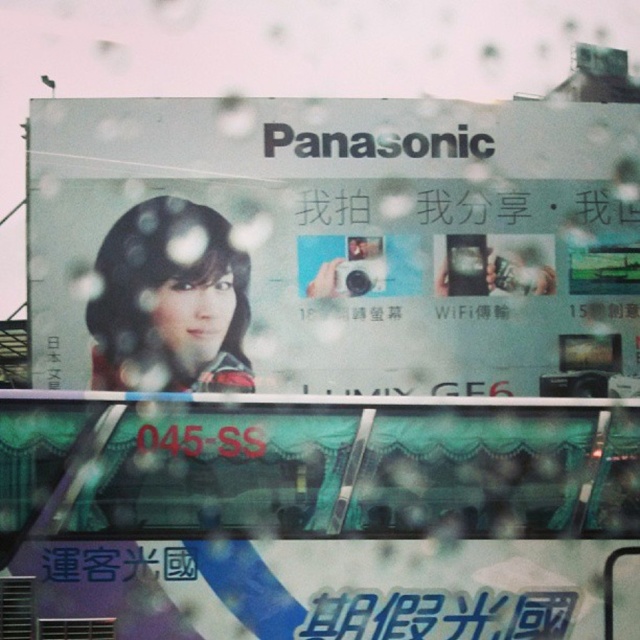
You are a pedestrian looking at the Panasonic billboard. You notice the teal fabric covered bus at lower center and the white glossy text at lower center. Which object takes up more space in the image?

The teal fabric covered bus at lower center takes up more space in the image because it has a larger size compared to the white glossy text at lower center.

You are standing in front of a Panasonic billboard advertisement. There are two points on the billboard at coordinates point (634, 275) and point (538, 596). Which point is closer to you?

Point (634, 275) is further to the viewer than point (538, 596), so point (538, 596) is closer to you.

You are a photographer standing in front of the Panasonic billboard. You notice a camera at the specified point. What color is the camera located at point (333, 244)?

The camera at point (333, 244) is matte silver.